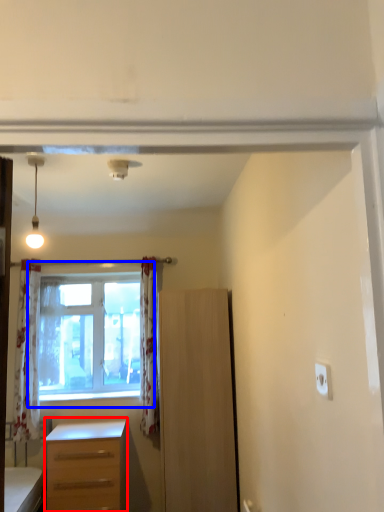
Question: Which point is further to the camera, desk (highlighted by a red box) or window (highlighted by a blue box)?

Choices:
 (A) desk
 (B) window

Answer: (B)